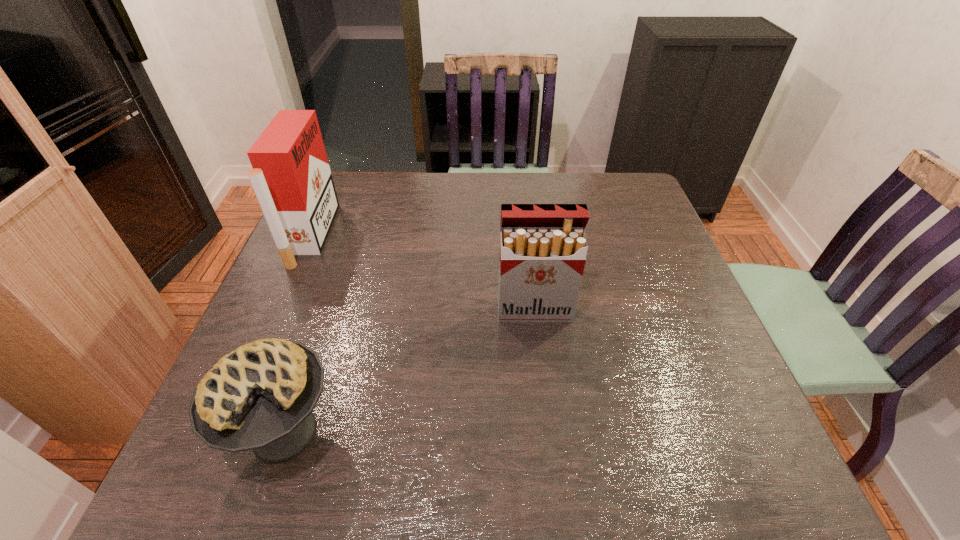
In order to click on vacant position at the far right corner of the desktop in this screenshot , I will do `click(617, 193)`.

Locate an element on the screen. The width and height of the screenshot is (960, 540). free space at the near right corner of the desktop is located at coordinates (744, 453).

The image size is (960, 540). In order to click on unoccupied position between the farthest object and the right cigarette case in this screenshot , I will do `click(423, 273)`.

Identify the location of vacant area that lies between the left cigarette case and the nearer cigarette case. (423, 273).

Locate an element on the screen. Image resolution: width=960 pixels, height=540 pixels. free space between the shortest object and the farthest object is located at coordinates (299, 334).

Find the location of `vacant space that is in between the nearest object and the farthest object`. vacant space that is in between the nearest object and the farthest object is located at coordinates (299, 334).

At what (x,y) coordinates should I click in order to perform the action: click on free space between the farther cigarette case and the shortest object. Please return your answer as a coordinate pair (x, y). The width and height of the screenshot is (960, 540). Looking at the image, I should click on (299, 334).

Where is `vacant space that's between the nearer cigarette case and the farthest object`? The width and height of the screenshot is (960, 540). vacant space that's between the nearer cigarette case and the farthest object is located at coordinates (423, 273).

Locate an element on the screen. The height and width of the screenshot is (540, 960). free space between the right cigarette case and the left cigarette case is located at coordinates (423, 273).

Where is `vacant point located between the nearer cigarette case and the nearest object`? Image resolution: width=960 pixels, height=540 pixels. vacant point located between the nearer cigarette case and the nearest object is located at coordinates (410, 371).